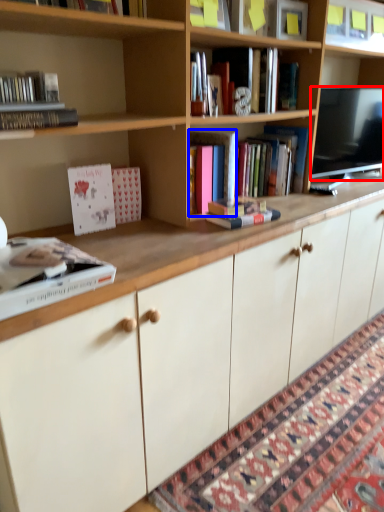
Question: Among these objects, which one is nearest to the camera, television (highlighted by a red box) or book (highlighted by a blue box)?

Choices:
 (A) television
 (B) book

Answer: (B)